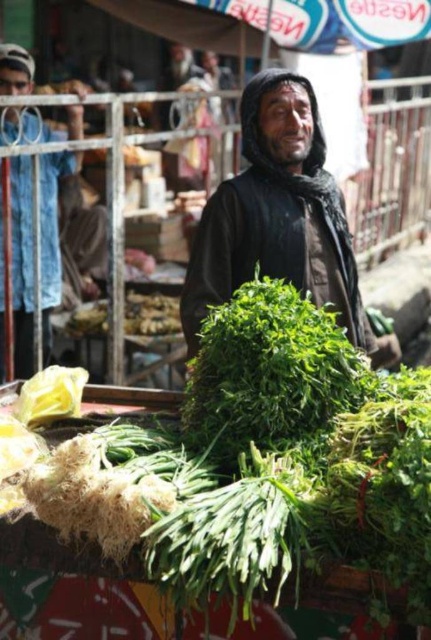
You are a customer at the market and want to place your bag on the dark brown fabric at center. The vendor says you can only place it if the point you choose is exactly at the center of the fabric. Is the point you chose, point (278,218), exactly at the center of the dark brown fabric at center?

The point (278,218) is on dark brown fabric at center, so yes, the point you chose is exactly at the center of the dark brown fabric at center.

You are a customer at the market and want to compare the sizes of the fabrics. Which fabric, the dark brown fabric at center or the blue fabric at left, is wider?

The dark brown fabric at center is wider than the blue fabric at left.